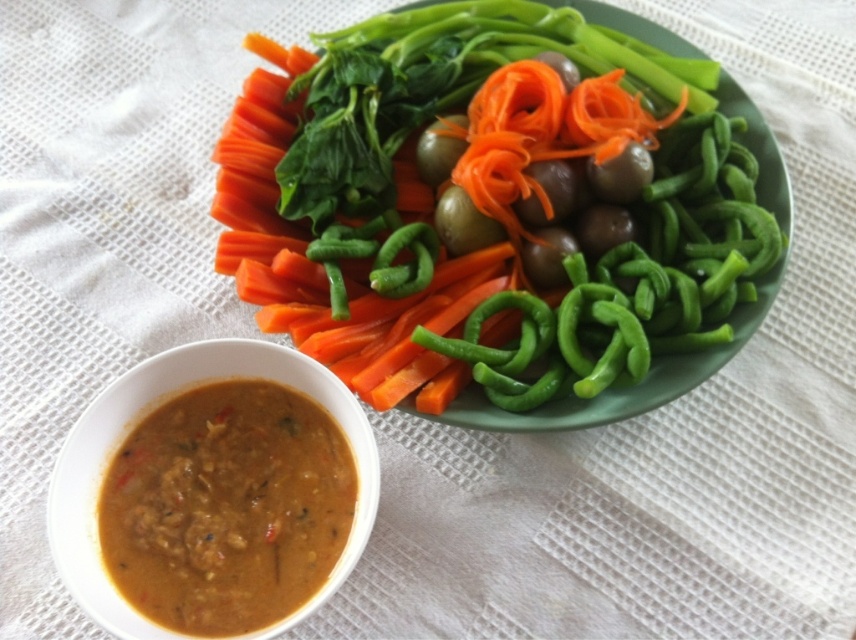
In the scene shown: Does green glossy bell pepper at upper center have a greater height compared to orange smooth carrot at center?

Yes.

This screenshot has width=856, height=640. I want to click on green glossy bell pepper at upper center, so click(503, 209).

Is brown creamy soup at lower left to the left of orange smooth carrot at center from the viewer's perspective?

Indeed, brown creamy soup at lower left is positioned on the left side of orange smooth carrot at center.

Which is behind, point (351, 484) or point (253, 140)?

The point (253, 140) is behind.

This screenshot has width=856, height=640. Find the location of `brown creamy soup at lower left`. brown creamy soup at lower left is located at coordinates (226, 508).

Who is higher up, green glossy bell pepper at upper center or brown creamy soup at lower left?

green glossy bell pepper at upper center

The height and width of the screenshot is (640, 856). What are the coordinates of `green glossy bell pepper at upper center` in the screenshot? It's located at point(503,209).

Is point (348, 124) farther from camera compared to point (290, 550)?

Yes, it is.

This screenshot has height=640, width=856. Identify the location of green glossy bell pepper at upper center. (503, 209).